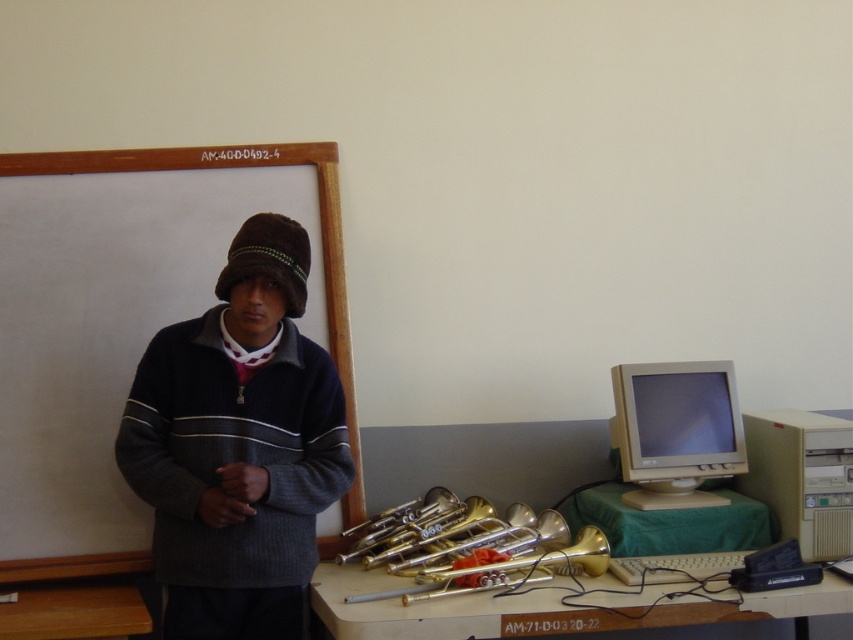
Question: Is metallic brass instruments at lower center positioned in front of beige plastic monitor at right?

Choices:
 (A) no
 (B) yes

Answer: (B)

Question: Observing the image, what is the correct spatial positioning of beige plastic monitor at right in reference to white matte chalkboard at upper left?

Choices:
 (A) below
 (B) above

Answer: (A)

Question: Which object appears farthest from the camera in this image?

Choices:
 (A) brown wooden table at lower left
 (B) dark blue knitted sweater at center
 (C) beige plastic computer at right
 (D) white matte chalkboard at upper left

Answer: (D)

Question: Among these points, which one is nearest to the camera?

Choices:
 (A) (743, 465)
 (B) (842, 609)

Answer: (B)

Question: Does dark blue knitted sweater at center lie behind white matte chalkboard at upper left?

Choices:
 (A) no
 (B) yes

Answer: (A)

Question: Based on their relative distances, which object is farther from the metallic brass instruments at lower center?

Choices:
 (A) gold brass trumpet at center
 (B) beige plastic monitor at right
 (C) brown wooden table at lower left
 (D) white matte chalkboard at upper left

Answer: (D)